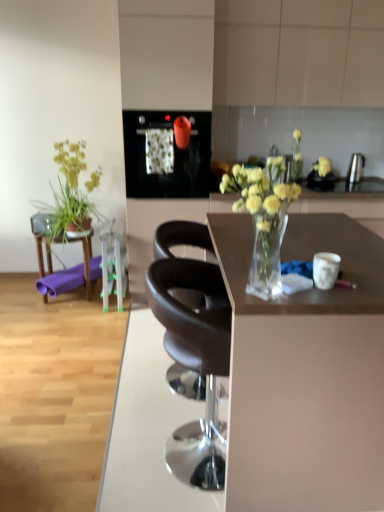
Question: In terms of size, does green leafy plant at left appear bigger or smaller than matte brown desk at center?

Choices:
 (A) big
 (B) small

Answer: (B)

Question: Do you think green leafy plant at left is within matte brown desk at center, or outside of it?

Choices:
 (A) outside
 (B) inside

Answer: (A)

Question: Based on their relative distances, which object is nearer to the satin silver kettle at upper right, which is the 1th appliance from back to front?

Choices:
 (A) matte brown desk at center
 (B) green leafy plant at left
 (C) matte black oven at upper center, which ranks as the 2th appliance in back-to-front order
 (D) black leather chair at center, positioned as the first chair in back-to-front order
 (E) green plastic bar stool at center

Answer: (C)

Question: Which of these objects is positioned farthest from the clear glass vase at center?

Choices:
 (A) black leather chair at center, the 2th chair from the front
 (B) matte brown desk at center
 (C) green leafy plant at left
 (D) white tile cabinetry at upper center
 (E) matte brown chair at center, which is the 2th chair in back-to-front order

Answer: (C)